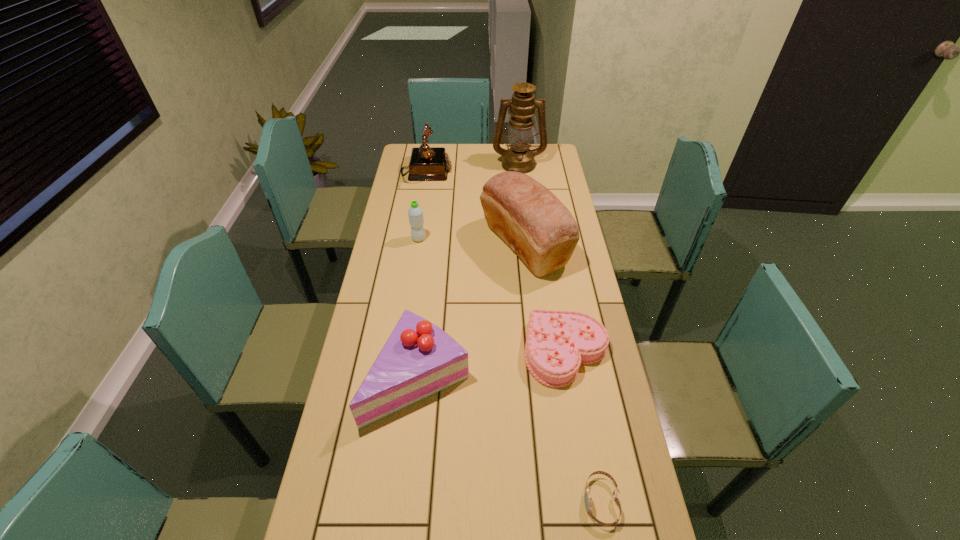
Locate an element on the screen. The image size is (960, 540). free space that satisfies the following two spatial constraints: 1. on the dial of the telephone; 2. on the right side of the taller cake is located at coordinates [x=394, y=378].

At what (x,y) coordinates should I click in order to perform the action: click on blank space that satisfies the following two spatial constraints: 1. on the dial of the telephone; 2. on the right side of the taller cake. Please return your answer as a coordinate pair (x, y). The height and width of the screenshot is (540, 960). Looking at the image, I should click on (394, 378).